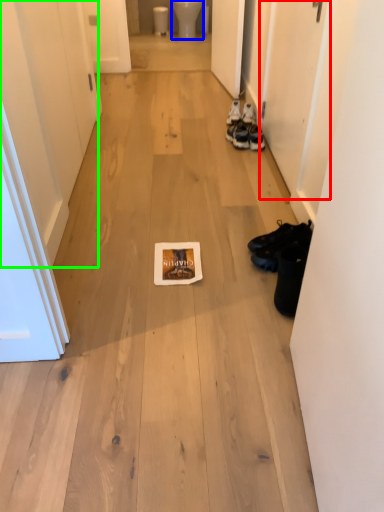
Question: Considering the real-world distances, which object is closest to door (highlighted by a red box)? toilet bowl (highlighted by a blue box) or door (highlighted by a green box).

Choices:
 (A) toilet bowl
 (B) door

Answer: (B)